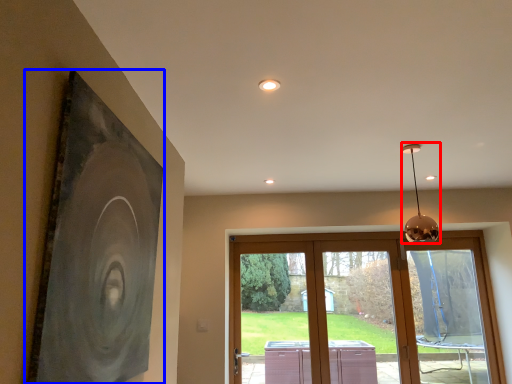
Question: Among these objects, which one is nearest to the camera, lamp (highlighted by a red box) or picture frame (highlighted by a blue box)?

Choices:
 (A) lamp
 (B) picture frame

Answer: (B)